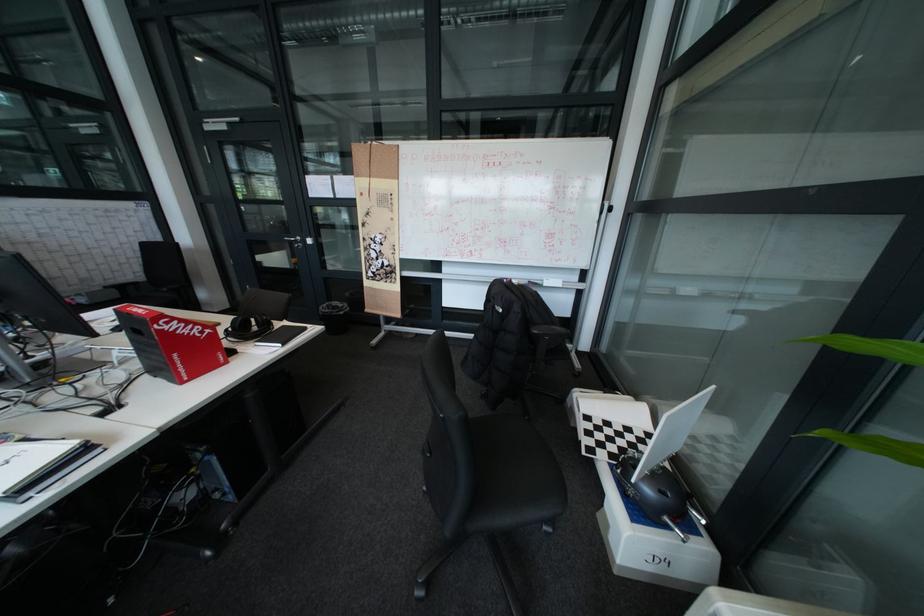
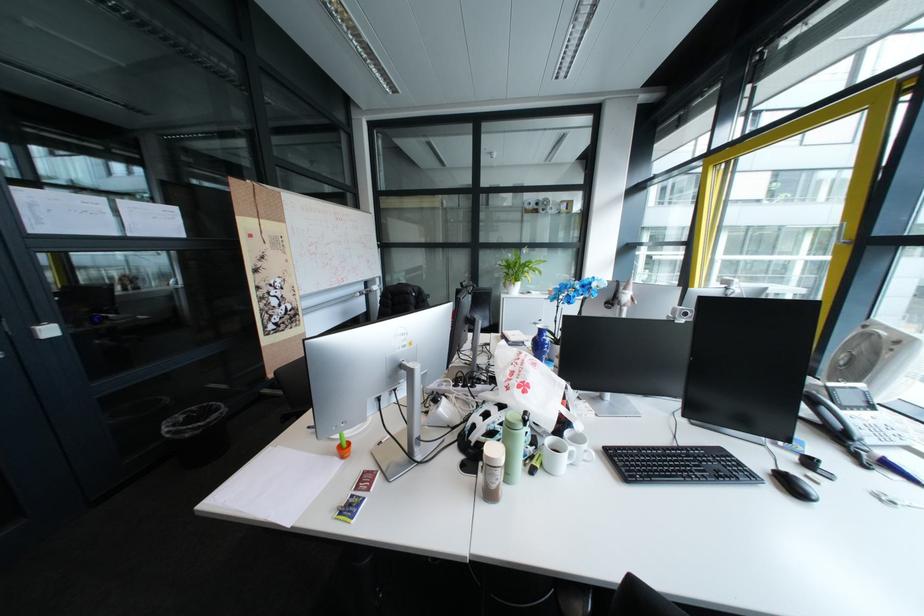
Question: I am providing you with two images of the same scene from different viewpoints. After the viewpoint changes to image2, which objects are now occluded?

Choices:
 (A) green bottle crate
 (B) orange pen holder
 (C) black computer mouse
 (D) black notebook

Answer: (D)